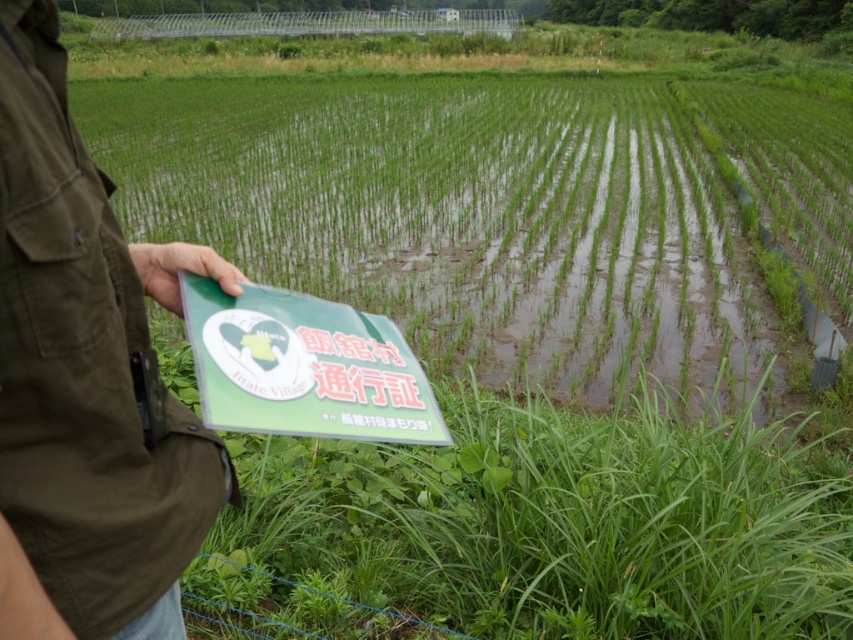
Question: Is green leafy grass at lower center positioned in front of green matte folder at left?

Choices:
 (A) no
 (B) yes

Answer: (A)

Question: Is green leafy grass at lower center wider than green matte folder at left?

Choices:
 (A) yes
 (B) no

Answer: (A)

Question: Where is green leafy grass at lower center located in relation to green matte folder at left in the image?

Choices:
 (A) above
 (B) below

Answer: (B)

Question: Which object is closer to the camera taking this photo?

Choices:
 (A) green leafy grass at lower center
 (B) green matte folder at left

Answer: (B)